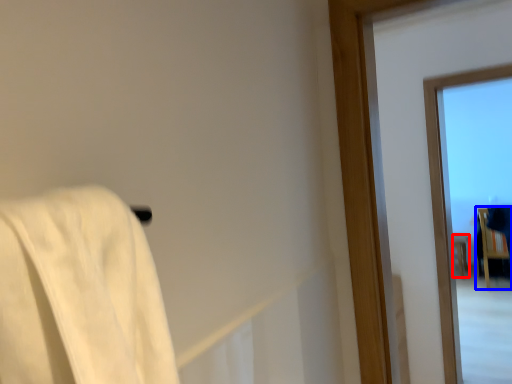
Question: Which object appears farthest to the camera in this image, furniture (highlighted by a red box) or furniture (highlighted by a blue box)?

Choices:
 (A) furniture
 (B) furniture

Answer: (A)